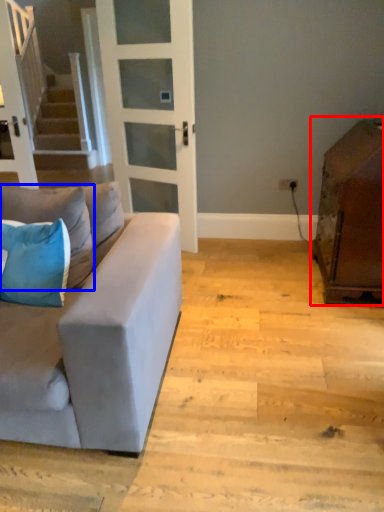
Question: Which of the following is the closest to the observer, cabinetry (highlighted by a red box) or pillow (highlighted by a blue box)?

Choices:
 (A) cabinetry
 (B) pillow

Answer: (B)